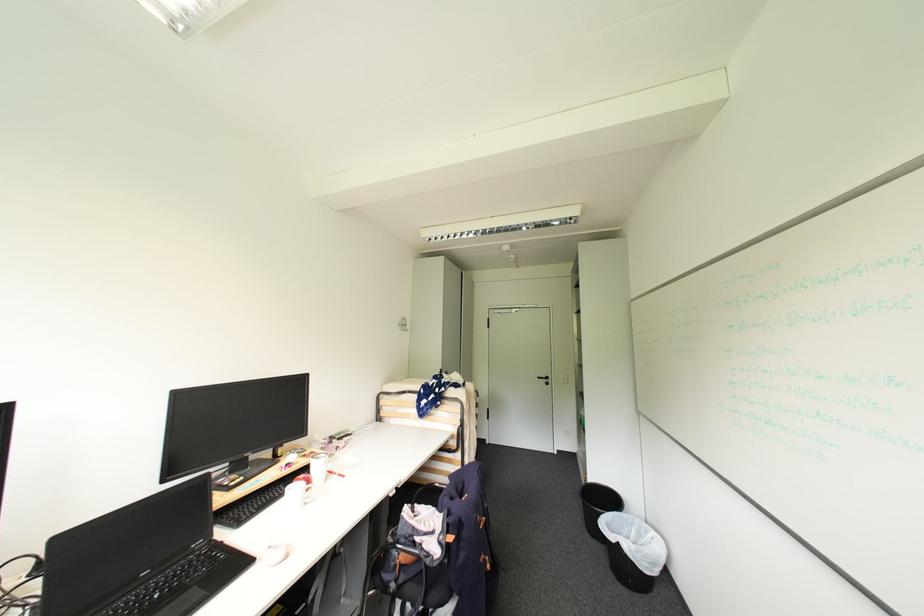
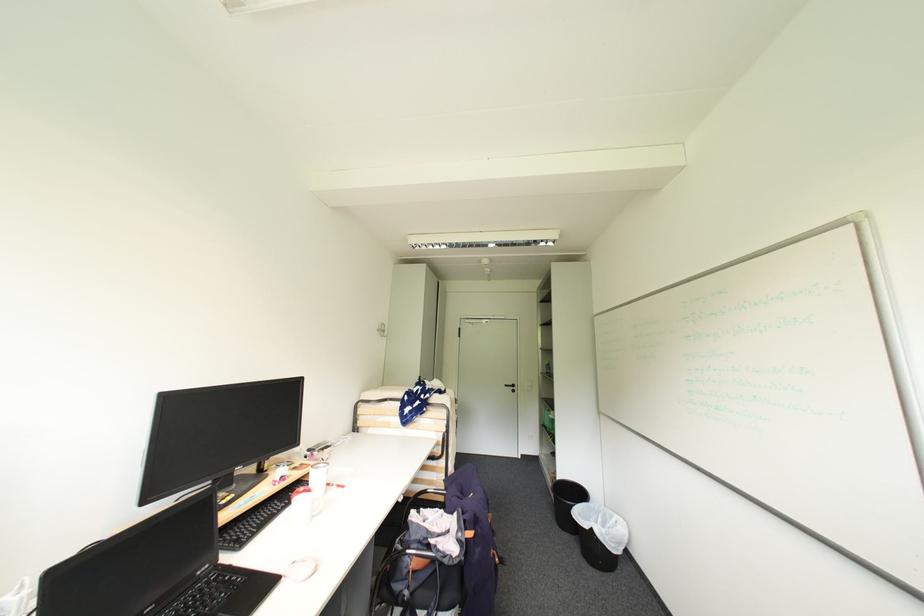
Question: I am providing you with two images of the same scene from different viewpoints. Which of the following objects are not visible in image2?

Choices:
 (A) chair sitting surface
 (B) metal wall hook
 (C) white cylindrical can
 (D) none of these

Answer: (D)